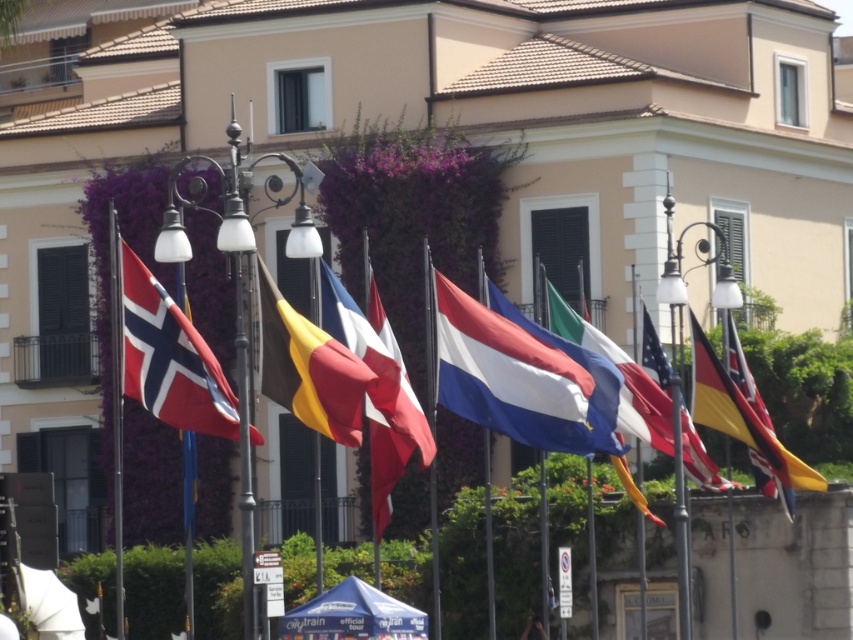
Consider the image. Does white fabric flag at center appear under red and white striped flag at center?

Correct, white fabric flag at center is located below red and white striped flag at center.

Is white fabric flag at center further to the viewer compared to red and white striped flag at center?

Yes, it is behind red and white striped flag at center.

What do you see at coordinates (512, 378) in the screenshot? This screenshot has height=640, width=853. I see `white fabric flag at center` at bounding box center [512, 378].

The height and width of the screenshot is (640, 853). I want to click on white fabric flag at center, so click(512, 378).

Based on the photo, does yellow fabric flag at center have a greater width compared to white and blue fabric flag at center?

No.

Can you confirm if yellow fabric flag at center is thinner than white and blue fabric flag at center?

Correct, yellow fabric flag at center's width is less than white and blue fabric flag at center's.

Is point (271, 365) closer to viewer compared to point (509, 317)?

That is True.

Locate an element on the screen. The image size is (853, 640). yellow fabric flag at center is located at coordinates (311, 369).

Can you confirm if white and blue fabric flag at center is wider than yellow and black striped flag at center?

Yes, white and blue fabric flag at center is wider than yellow and black striped flag at center.

Which is above, white and blue fabric flag at center or yellow and black striped flag at center?

yellow and black striped flag at center is higher up.

This screenshot has width=853, height=640. What do you see at coordinates (592, 392) in the screenshot?
I see `white and blue fabric flag at center` at bounding box center [592, 392].

Image resolution: width=853 pixels, height=640 pixels. I want to click on white and blue fabric flag at center, so click(x=592, y=392).